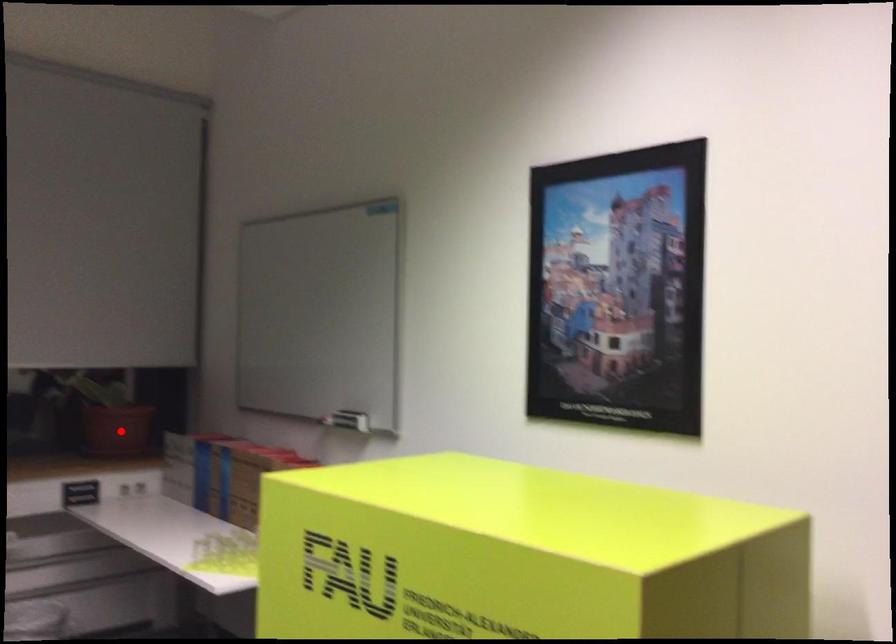
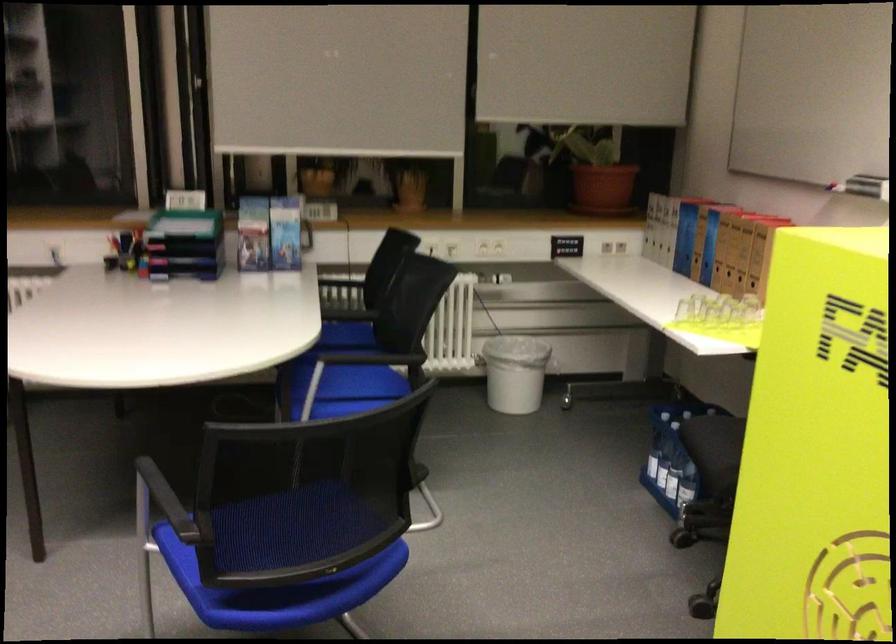
In the second image, find the point that corresponds to the highlighted location in the first image.

(602, 187)